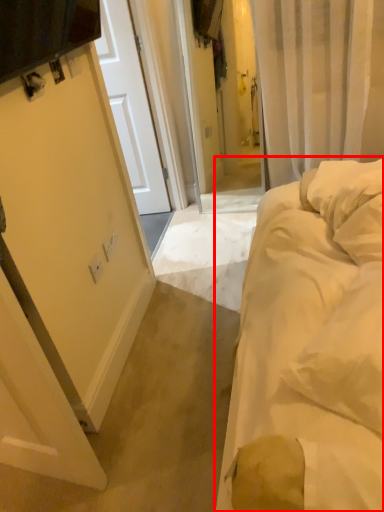
Question: From the image's perspective, where is bed (annotated by the red box) located relative to electric outlet?

Choices:
 (A) below
 (B) above

Answer: (A)